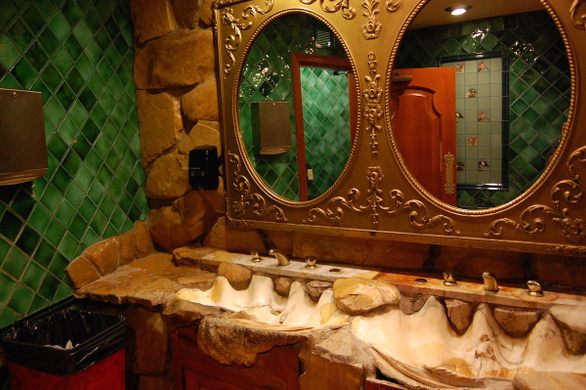
The height and width of the screenshot is (390, 586). Find the location of `light`. light is located at coordinates (459, 10).